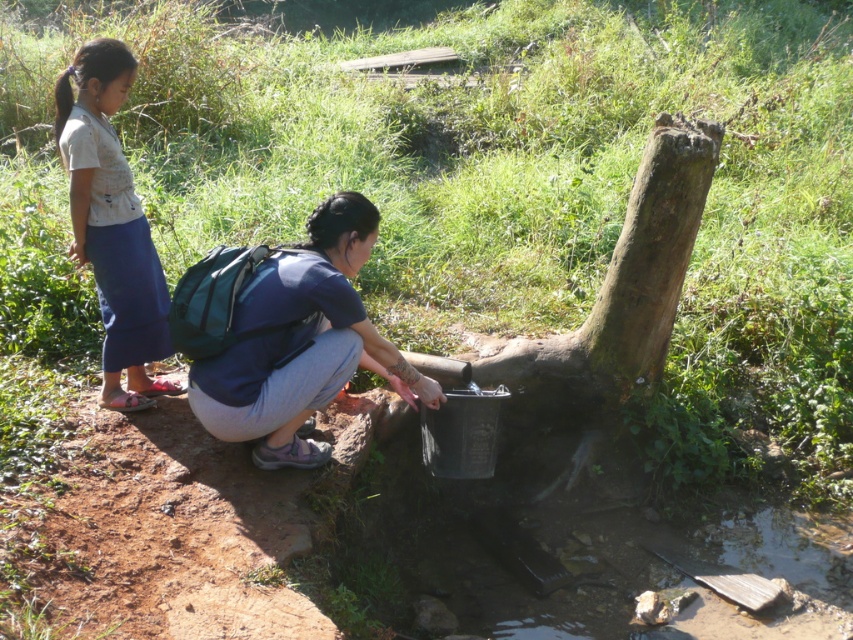
You are a hiker trying to locate the green mossy tree trunk at center. If you are facing north, which direction should you turn to find it?

The green mossy tree trunk at center is located at coordinates 0.450 in the x and 0.729 in the y. Since the y coordinate is 0.729, which is higher than 0.5, it is positioned towards the top half of the image. The x coordinate 0.450 is slightly to the left of center. Therefore, if facing north, you should turn slightly to your left to face northeast to locate the green mossy tree trunk at center.

You are hiking in a forest and need to locate your backpack and skirt. Based on the scene, where is the blue fabric backpack at center in relation to the light blue denim skirt at left?

The blue fabric backpack at center is below the light blue denim skirt at left.